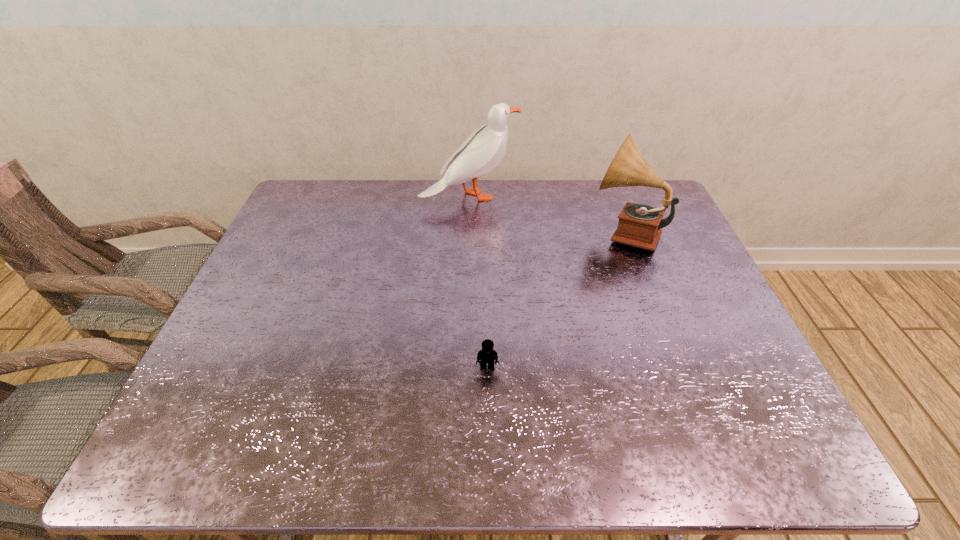
Image resolution: width=960 pixels, height=540 pixels. Identify the location of free point between the nearest object and the rightmost object. (556, 300).

This screenshot has height=540, width=960. In order to click on free space between the nearest object and the phonograph record in this screenshot , I will do `click(556, 300)`.

Locate an element on the screen. The height and width of the screenshot is (540, 960). free space between the nearest object and the phonograph record is located at coordinates (556, 300).

The width and height of the screenshot is (960, 540). Find the location of `free space between the nearest object and the phonograph record`. free space between the nearest object and the phonograph record is located at coordinates (556, 300).

At what (x,y) coordinates should I click in order to perform the action: click on vacant area that lies between the shortest object and the rightmost object. Please return your answer as a coordinate pair (x, y). Image resolution: width=960 pixels, height=540 pixels. Looking at the image, I should click on (556, 300).

You are a GUI agent. You are given a task and a screenshot of the screen. Output one action in this format:
    pyautogui.click(x=<x>, y=<y>)
    Task: Click on the free point between the rightmost object and the Lego
    
    Given the screenshot: What is the action you would take?
    pyautogui.click(x=556, y=300)

This screenshot has height=540, width=960. In order to click on vacant area that lies between the phonograph record and the nearest object in this screenshot , I will do `click(556, 300)`.

Image resolution: width=960 pixels, height=540 pixels. Find the location of `free spot between the gull and the Lego`. free spot between the gull and the Lego is located at coordinates click(x=478, y=282).

You are a GUI agent. You are given a task and a screenshot of the screen. Output one action in this format:
    pyautogui.click(x=<x>, y=<y>)
    Task: Click on the object identified as the closest to the phonograph record
    
    Given the screenshot: What is the action you would take?
    pyautogui.click(x=483, y=150)

Find the location of a particular element. This screenshot has height=540, width=960. object that stands as the closest to the Lego is located at coordinates (639, 225).